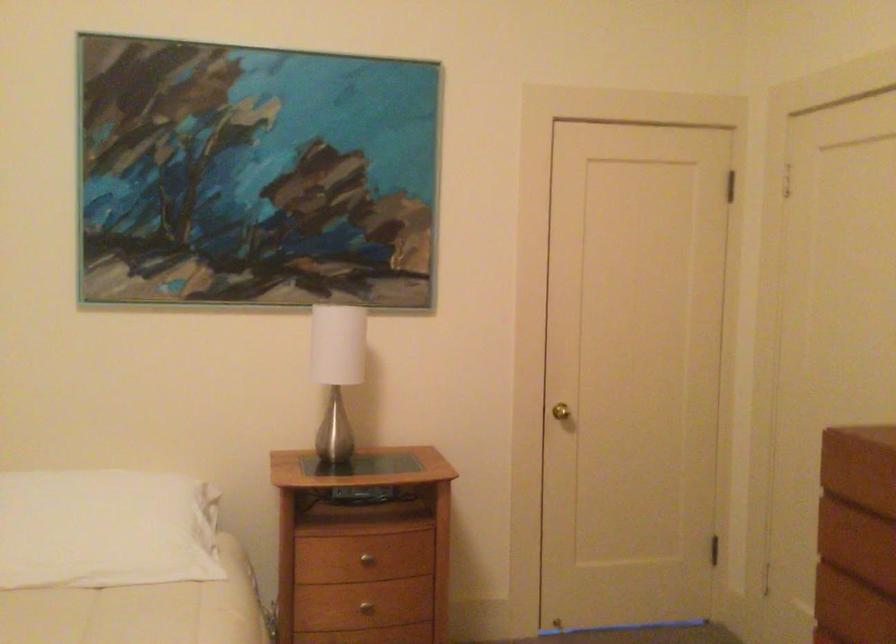
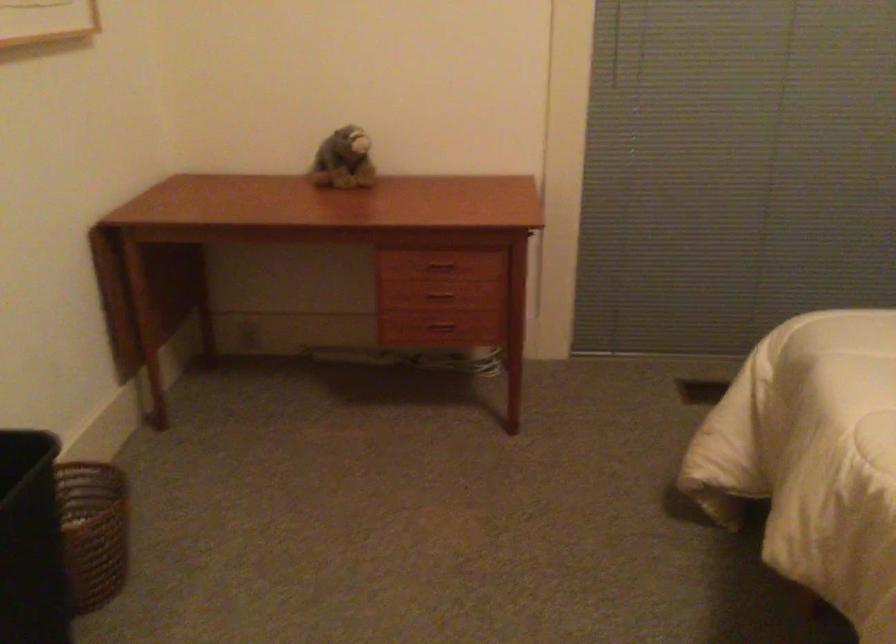
Based on the continuous images, in which direction is the camera rotating?

The rotation direction of the camera is left-down.